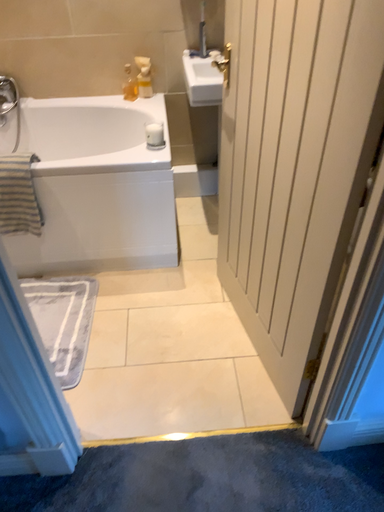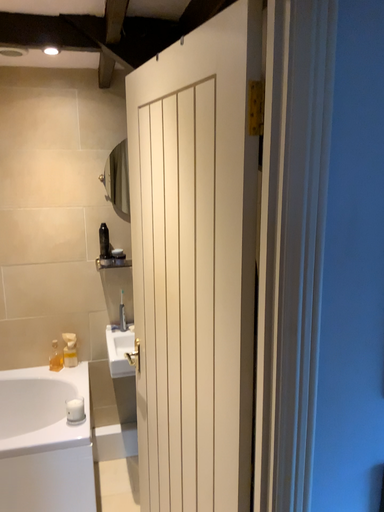
Question: How did the camera likely rotate when shooting the video?

Choices:
 (A) rotated upward
 (B) rotated downward

Answer: (A)